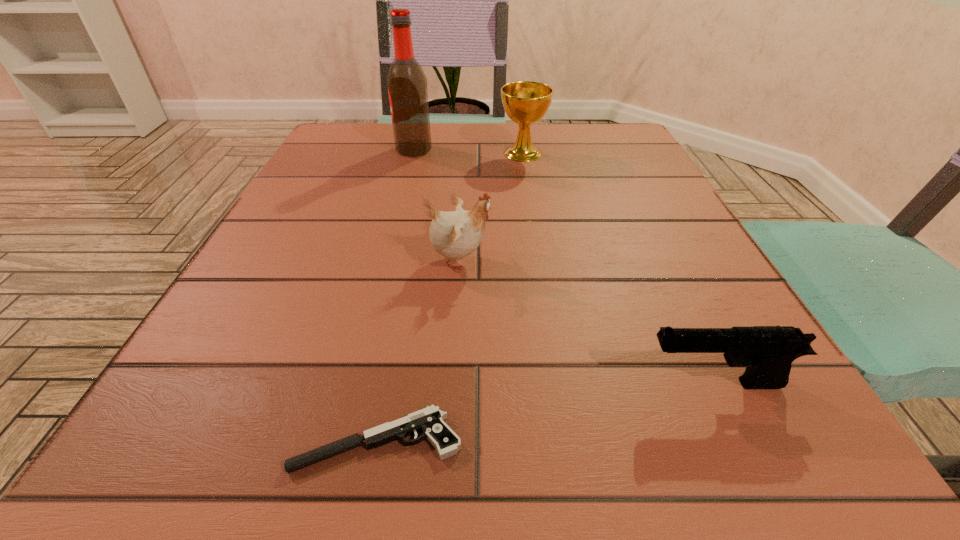
At what (x,y) coordinates should I click in order to perform the action: click on the tallest object. Please return your answer as a coordinate pair (x, y). The width and height of the screenshot is (960, 540). Looking at the image, I should click on (407, 84).

At what (x,y) coordinates should I click in order to perform the action: click on the fourth object from left to right. Please return your answer as a coordinate pair (x, y). Looking at the image, I should click on (525, 102).

This screenshot has height=540, width=960. Identify the location of bird. (456, 234).

The height and width of the screenshot is (540, 960). I want to click on the rightmost object, so click(767, 352).

At what (x,y) coordinates should I click in order to perform the action: click on the second shortest object. Please return your answer as a coordinate pair (x, y). Image resolution: width=960 pixels, height=540 pixels. Looking at the image, I should click on (767, 352).

The height and width of the screenshot is (540, 960). In order to click on the nearest object in this screenshot , I will do `click(429, 420)`.

This screenshot has width=960, height=540. Identify the location of the shortest object. (429, 420).

I want to click on free point located on the right of the beer bottle, so click(509, 150).

The width and height of the screenshot is (960, 540). What are the coordinates of `free space located 0.090m on the front of the chalice` in the screenshot? It's located at (528, 185).

Where is `free location located at the beak of the third farthest object`? The height and width of the screenshot is (540, 960). free location located at the beak of the third farthest object is located at coordinates (676, 261).